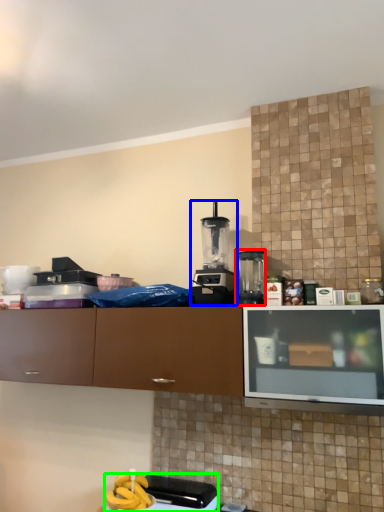
Question: Estimate the real-world distances between objects in this image. Which object is farther from kitchen appliance (highlighted by a red box), kitchen appliance (highlighted by a blue box) or appliance (highlighted by a green box)?

Choices:
 (A) kitchen appliance
 (B) appliance

Answer: (B)